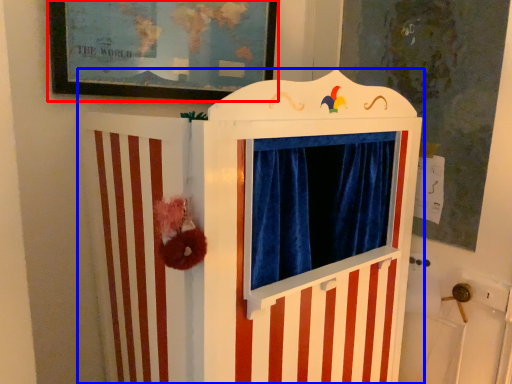
Question: Among these objects, which one is farthest to the camera, picture frame (highlighted by a red box) or furniture (highlighted by a blue box)?

Choices:
 (A) picture frame
 (B) furniture

Answer: (A)